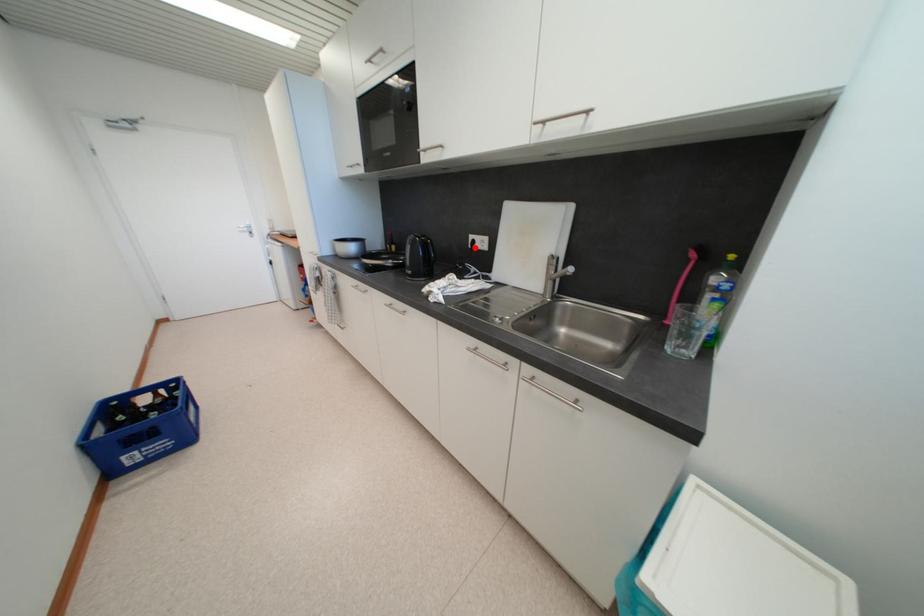
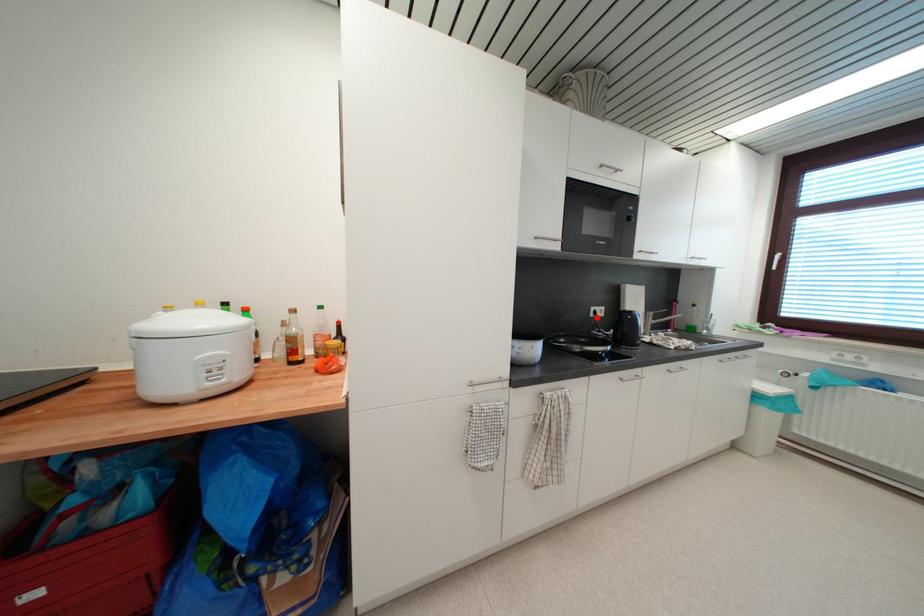
I am providing you with two images of the same scene from different viewpoints. A red point is marked on the first image and another point is marked on the second image. Is the marked point in image1 the same physical position as the marked point in image2?

Yes